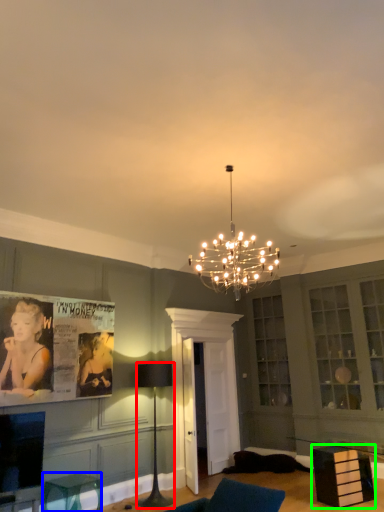
Question: Considering the real-world distances, which object is closest to lamp (highlighted by a red box)? furniture (highlighted by a blue box) or furniture (highlighted by a green box).

Choices:
 (A) furniture
 (B) furniture

Answer: (A)